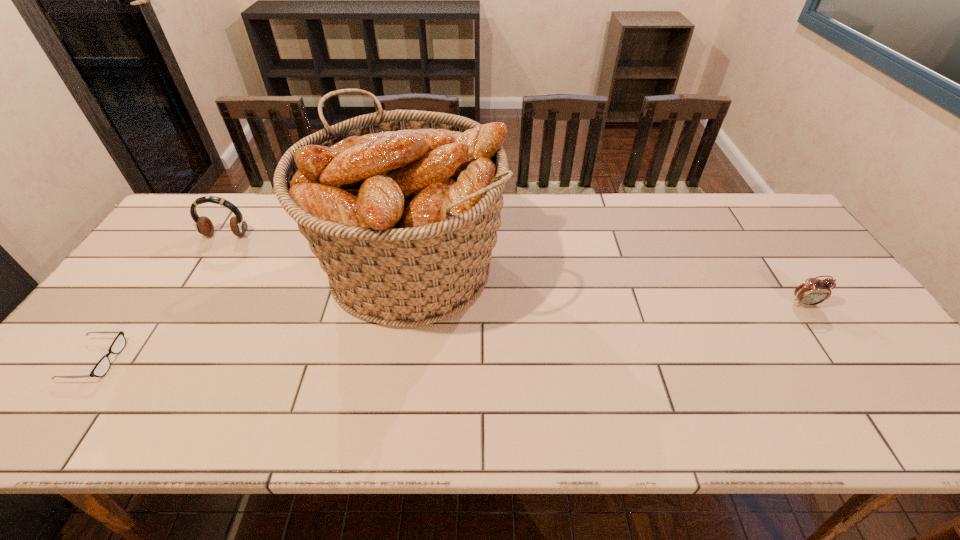
Image resolution: width=960 pixels, height=540 pixels. I want to click on the third object from left to right, so click(402, 207).

The image size is (960, 540). What are the coordinates of `basket` in the screenshot? It's located at (402, 207).

Where is `the third shortest object`? Image resolution: width=960 pixels, height=540 pixels. the third shortest object is located at coordinates (203, 225).

Where is `the third tallest object`? The height and width of the screenshot is (540, 960). the third tallest object is located at coordinates (813, 291).

Locate an element on the screen. The width and height of the screenshot is (960, 540). the rightmost object is located at coordinates (813, 291).

Image resolution: width=960 pixels, height=540 pixels. In order to click on spectacles in this screenshot , I will do `click(101, 368)`.

The height and width of the screenshot is (540, 960). What are the coordinates of `vacant space positioned on the left of the basket` in the screenshot? It's located at (250, 268).

Identify the location of vacant region located on the ear cup of the headset. Image resolution: width=960 pixels, height=540 pixels. (166, 330).

This screenshot has height=540, width=960. Identify the location of free region located on the face of the third tallest object. (833, 346).

Locate an element on the screen. vacant space located 0.210m on the front-facing side of the spectacles is located at coordinates (205, 360).